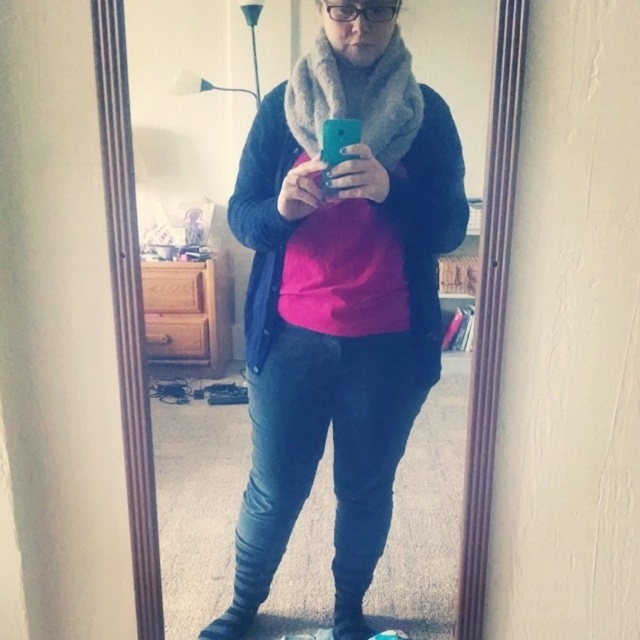
You are organizing a closet and see the fuzzy gray scarf at upper center and the gray woolen scarf at center. Which scarf is positioned lower in the closet?

The fuzzy gray scarf at upper center is located below the gray woolen scarf at center, so the fuzzy gray scarf at upper center is positioned lower in the closet.